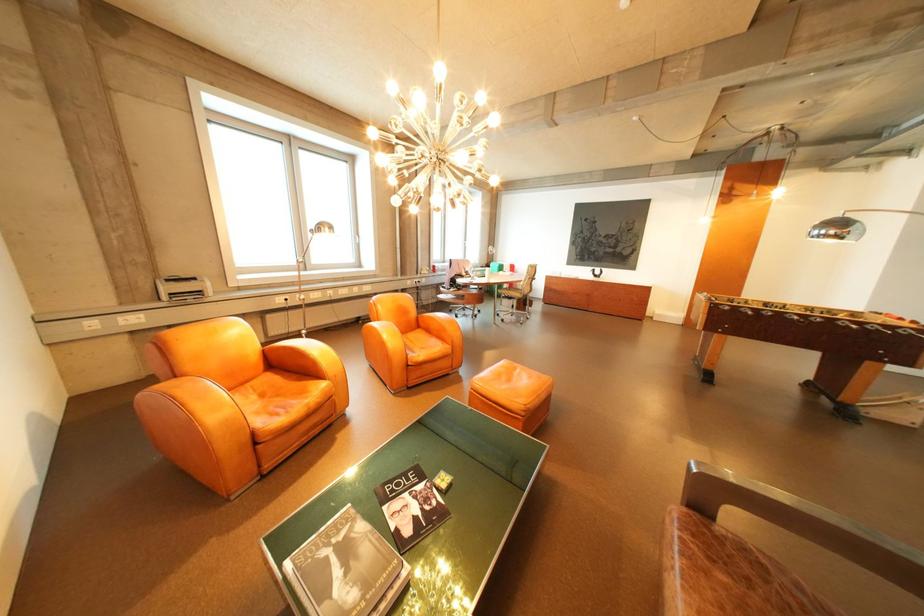
Find where to resting arm the wooden chair armrest. Please return your answer as a coordinate pair (x, y).

(751, 498)